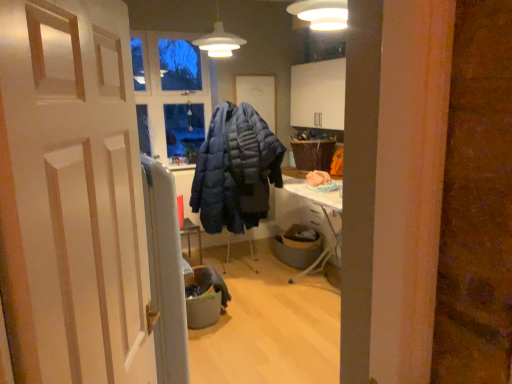
Locate an element on the screen. The height and width of the screenshot is (384, 512). free spot to the right of gray fabric trash bin at center, placed as the 2th trash bin/can when sorted from right to left is located at coordinates (260, 306).